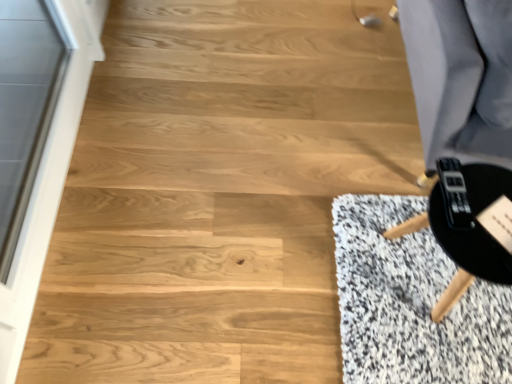
Find the location of a particular element. Image resolution: width=512 pixels, height=384 pixels. free space on the front side of black matte round table at lower right is located at coordinates (430, 355).